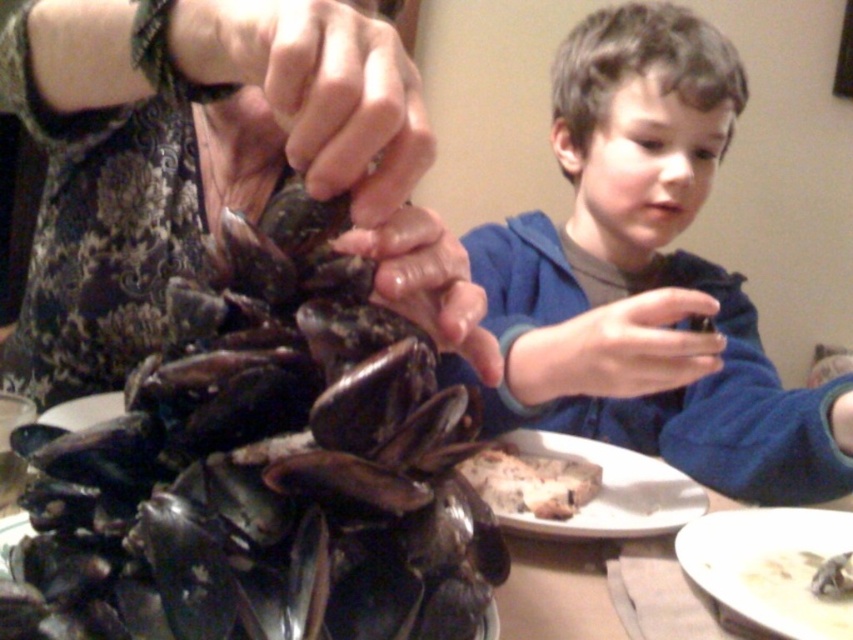
You are a guest at the table and want to reach for the white crumbly bread at center without disturbing the white matte bowl at lower right. Which object should you move first?

You should move the white crumbly bread at center first because the white matte bowl at lower right is closer to you and moving the bread would not require moving the bowl.

You are a chef preparing a meal and need to place the white matte bowl at lower right closer to the white crumbly bread at center. How much distance do you need to move the bowl to make them touch?

The distance between the white matte bowl at lower right and the white crumbly bread at center is 4.67 inches. To make them touch, you need to move the bowl by 4.67 inches towards the bread.

Based on the scene described, which object is positioned to the left when looking at the shiny dark shell at center and the white matte bowl at lower right?

The shiny dark shell at center is positioned to the left of the white matte bowl at lower right.